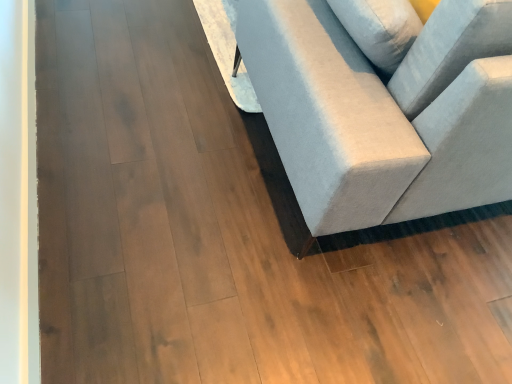
Identify the location of free location in front of light gray fabric couch at right. The image size is (512, 384). (270, 272).